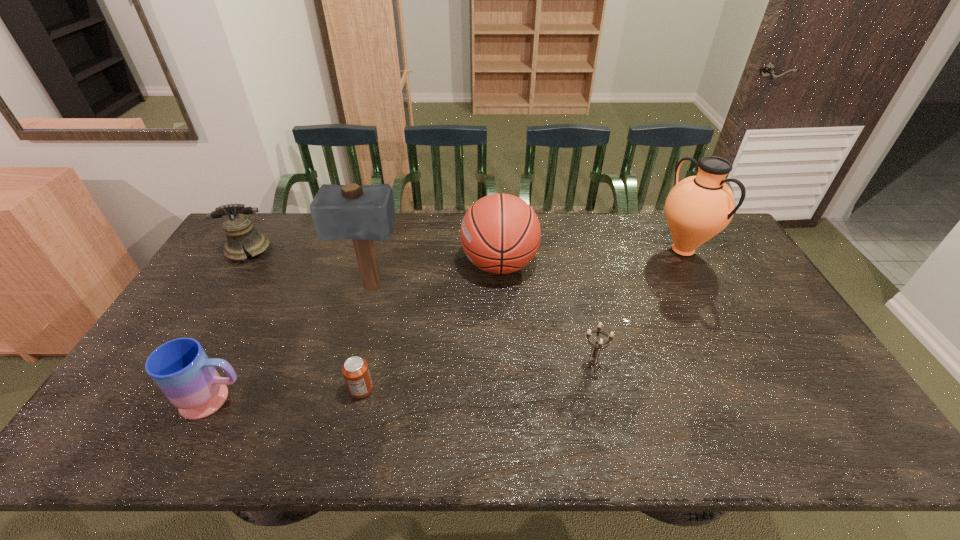
This screenshot has width=960, height=540. In order to click on object that is the fifth closest one to the basketball in this screenshot , I will do `click(182, 370)`.

In order to click on the fourth closest object to the candle holder in this screenshot , I will do `click(364, 213)`.

Where is `blank space that satisfies the following two spatial constraints: 1. on the logo side of the third object from right to left; 2. on the right side of the third nearest object`? This screenshot has width=960, height=540. blank space that satisfies the following two spatial constraints: 1. on the logo side of the third object from right to left; 2. on the right side of the third nearest object is located at coordinates (504, 366).

Locate an element on the screen. The height and width of the screenshot is (540, 960). vacant space that satisfies the following two spatial constraints: 1. on the front side of the mallet; 2. on the right side of the bell is located at coordinates (225, 288).

The height and width of the screenshot is (540, 960). I want to click on free space that satisfies the following two spatial constraints: 1. on the back side of the shortest object; 2. on the left side of the sixth object from left to right, so click(x=367, y=366).